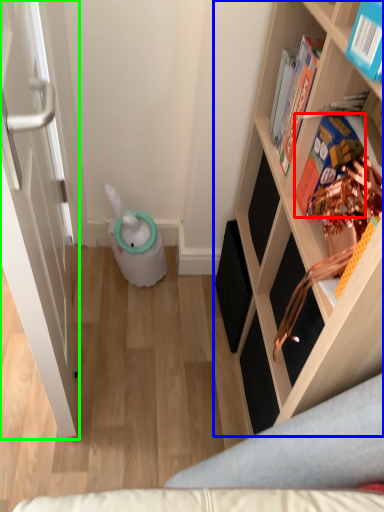
Question: Considering the real-world distances, which object is farthest from book (highlighted by a red box)? shelf (highlighted by a blue box) or door (highlighted by a green box)?

Choices:
 (A) shelf
 (B) door

Answer: (B)